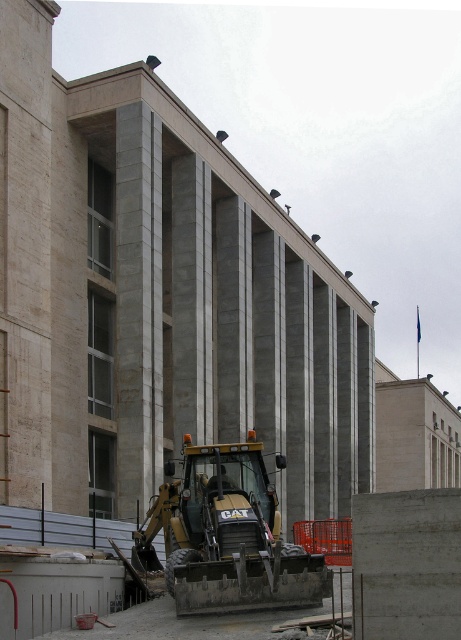
Looking at this image, you are standing at the construction site and want to move the gold metallic excavator at center to the storage area located 20 meters away. Can you safely move it without exceeding the distance limit?

The gold metallic excavator at center is currently 19.84 meters away from the viewer. Since the storage area is 20 meters away, the excavator can be moved safely as the distance is within the limit.